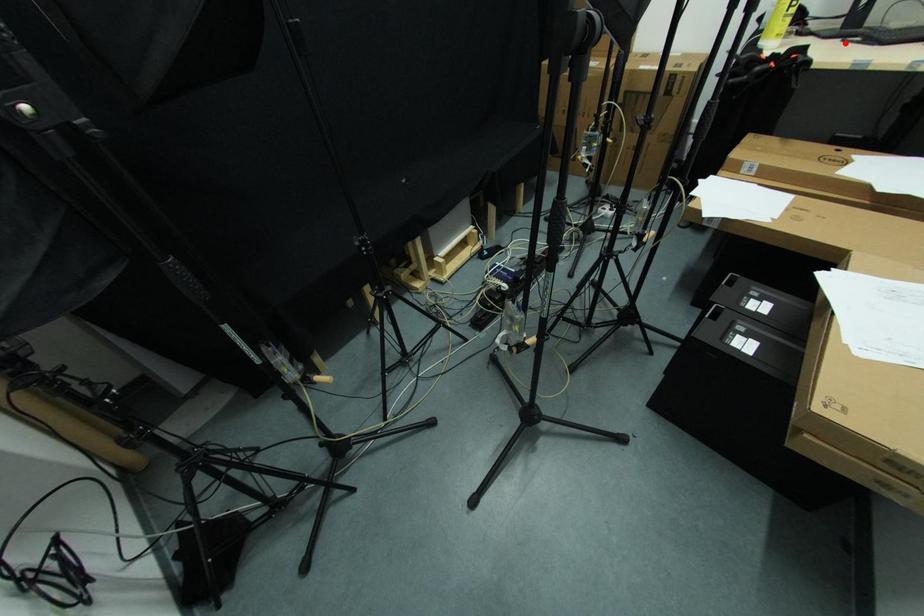
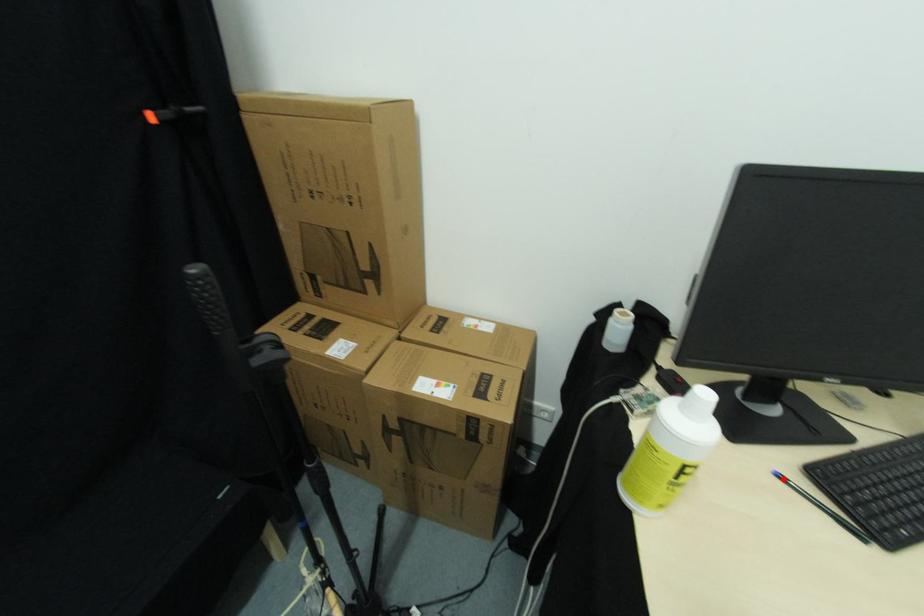
I am providing you with two images of the same scene from different viewpoints. A red point is marked on the first image and another point is marked on the second image. Is the red point in image1 aligned with the point shown in image2?

Yes